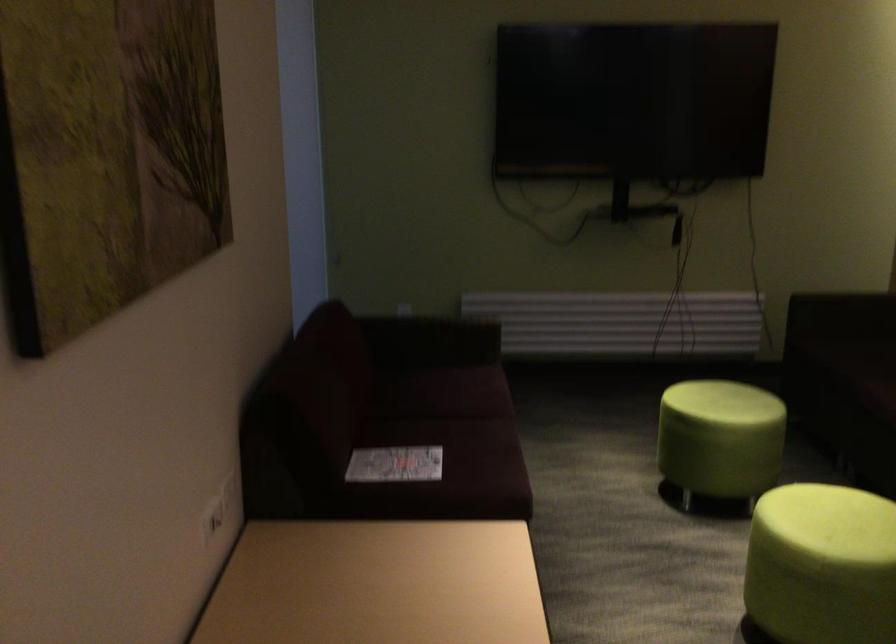
Where is `dark sofa armrest`? dark sofa armrest is located at coordinates (437, 303).